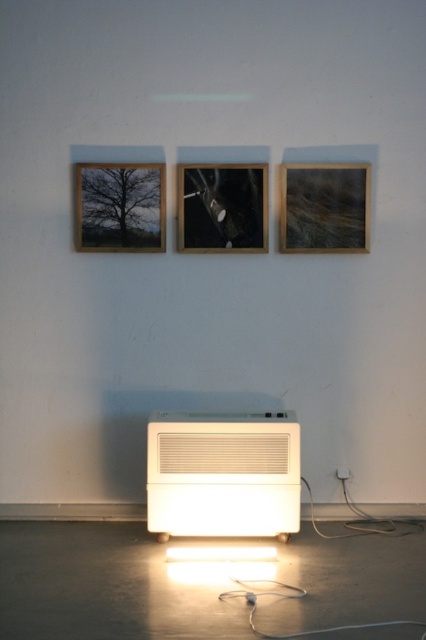
You are standing in front of the appliance and want to hang a new picture frame between the wooden frame at upper left and the wooden frame at center. Based on their positions, which frame is closer to you, making it easier to reach?

The wooden frame at upper left is closer to the viewer than the wooden frame at center, so it is easier to reach.

You are a delivery person who needs to place a new package that is 4 feet wide between the white plastic air conditioner at lower center and the wooden frame at center. Can you fit the package between them without moving either object?

The distance between the white plastic air conditioner at lower center and the wooden frame at center is 4.05 feet. Since the package is 4 feet wide, it can fit between them as the available space is slightly larger than the package width.